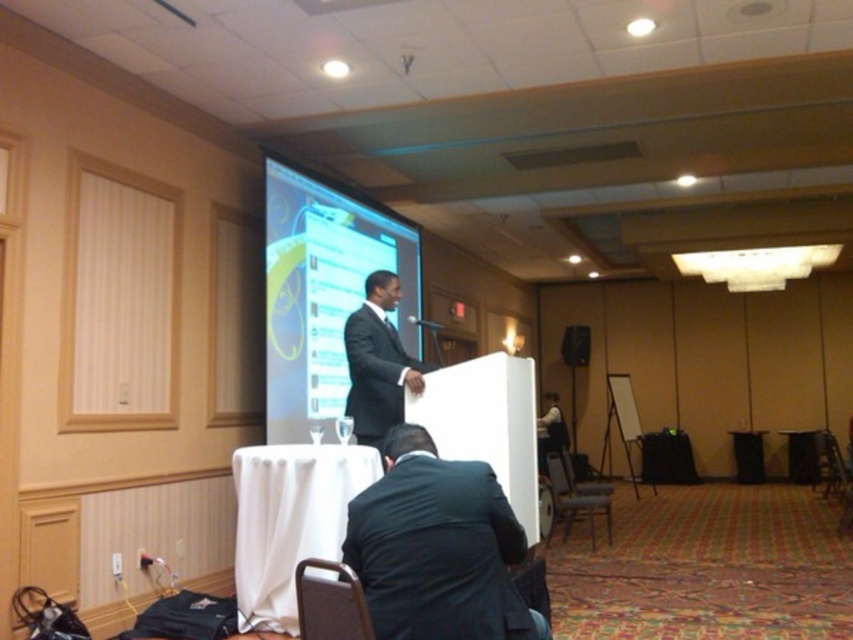
Does point (386, 252) lie behind point (590, 540)?

No, it is in front of (590, 540).

Which is in front, point (381, 260) or point (596, 497)?

Point (381, 260)

I want to click on matte black screen at center, so click(x=325, y=294).

Is matte black screen at center closer to camera compared to white cloth-covered table at lower center?

No, matte black screen at center is behind white cloth-covered table at lower center.

Does matte black screen at center appear on the left side of white cloth-covered table at lower center?

No, matte black screen at center is not to the left of white cloth-covered table at lower center.

The image size is (853, 640). I want to click on matte black screen at center, so click(325, 294).

Can you confirm if dark suit at center is positioned to the left of metallic gray chair at lower center?

Correct, you'll find dark suit at center to the left of metallic gray chair at lower center.

Who is more distant from viewer, [376,499] or [577,509]?

The point [577,509] is more distant.

Measure the distance between point (x=509, y=520) and camera.

They are 7.99 feet apart.

Where is `dark suit at center`? The image size is (853, 640). dark suit at center is located at coordinates (437, 547).